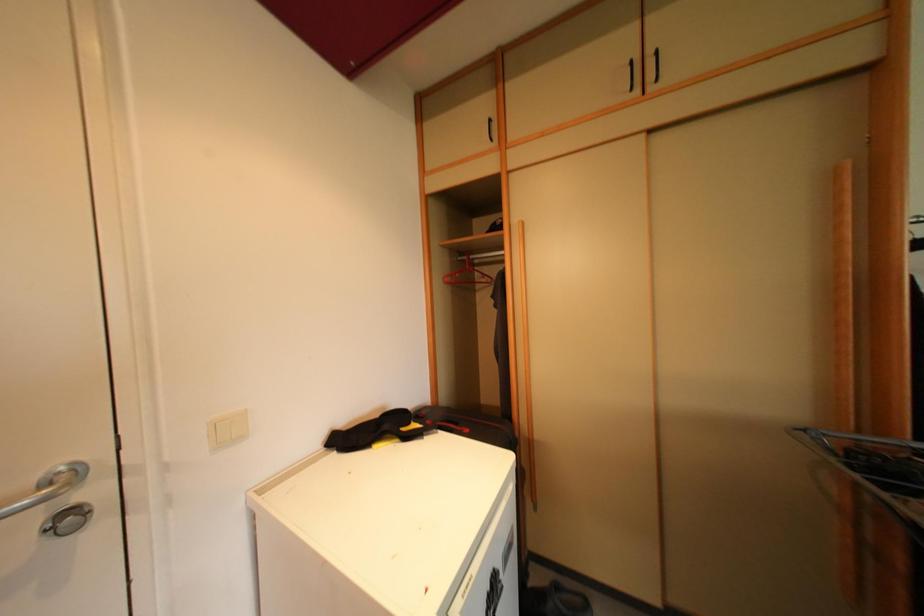
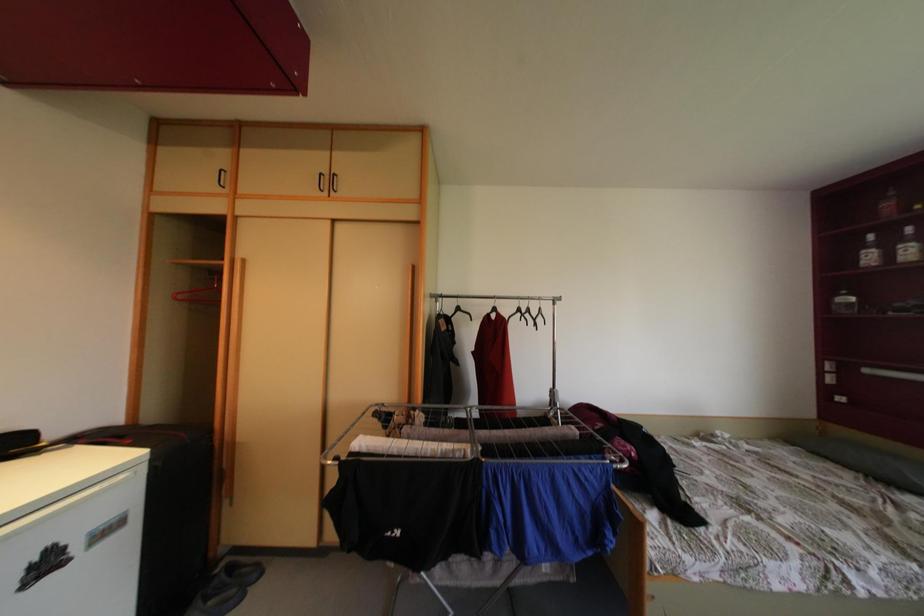
Question: The camera is either moving clockwise (left) or counter-clockwise (right) around the object. The first image is from the beginning of the video and the second image is from the end. Is the camera moving left or right when shooting the video?

Choices:
 (A) Left
 (B) Right

Answer: (A)